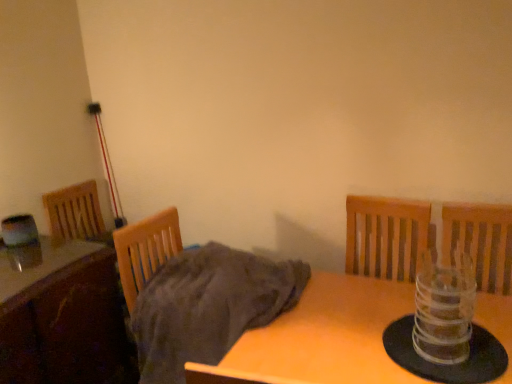
Question: Which direction should I rotate to look at wooden table at center, which is the 1th table in right-to-left order, — up or down?

Choices:
 (A) up
 (B) down

Answer: (B)

Question: Is gray cotton blanket at center wider than wooden table at center, marked as the second table in a left-to-right arrangement?

Choices:
 (A) yes
 (B) no

Answer: (B)

Question: Would you consider gray cotton blanket at center to be distant from wooden table at center, marked as the second table in a left-to-right arrangement?

Choices:
 (A) yes
 (B) no

Answer: (B)

Question: Is gray cotton blanket at center thinner than wooden table at center, marked as the second table in a left-to-right arrangement?

Choices:
 (A) no
 (B) yes

Answer: (B)

Question: From the image's perspective, is gray cotton blanket at center on wooden table at center, which is the 1th table in right-to-left order?

Choices:
 (A) yes
 (B) no

Answer: (A)

Question: Is the depth of gray cotton blanket at center greater than that of wooden table at center, marked as the second table in a left-to-right arrangement?

Choices:
 (A) no
 (B) yes

Answer: (B)

Question: Considering the relative sizes of gray cotton blanket at center and wooden table at center, marked as the second table in a left-to-right arrangement, in the image provided, is gray cotton blanket at center shorter than wooden table at center, marked as the second table in a left-to-right arrangement,?

Choices:
 (A) no
 (B) yes

Answer: (B)

Question: Is transparent plastic candle holder at right taller than wooden table at lower left, positioned as the 2th table in right-to-left order?

Choices:
 (A) yes
 (B) no

Answer: (B)

Question: Does transparent plastic candle holder at right have a greater width compared to wooden table at lower left, which appears as the 1th table when viewed from the left?

Choices:
 (A) yes
 (B) no

Answer: (B)

Question: Can you confirm if transparent plastic candle holder at right is bigger than wooden table at lower left, positioned as the 2th table in right-to-left order?

Choices:
 (A) no
 (B) yes

Answer: (A)

Question: From a real-world perspective, is transparent plastic candle holder at right on top of wooden table at lower left, positioned as the 2th table in right-to-left order?

Choices:
 (A) yes
 (B) no

Answer: (A)

Question: Is transparent plastic candle holder at right positioned behind wooden table at lower left, positioned as the 2th table in right-to-left order?

Choices:
 (A) yes
 (B) no

Answer: (B)

Question: Considering the relative positions of transparent plastic candle holder at right and wooden table at lower left, positioned as the 2th table in right-to-left order, in the image provided, is transparent plastic candle holder at right to the left of wooden table at lower left, positioned as the 2th table in right-to-left order, from the viewer's perspective?

Choices:
 (A) no
 (B) yes

Answer: (A)

Question: Considering the relative sizes of transparent plastic candle holder at right and wooden table at center, marked as the second table in a left-to-right arrangement, in the image provided, is transparent plastic candle holder at right taller than wooden table at center, marked as the second table in a left-to-right arrangement,?

Choices:
 (A) no
 (B) yes

Answer: (A)